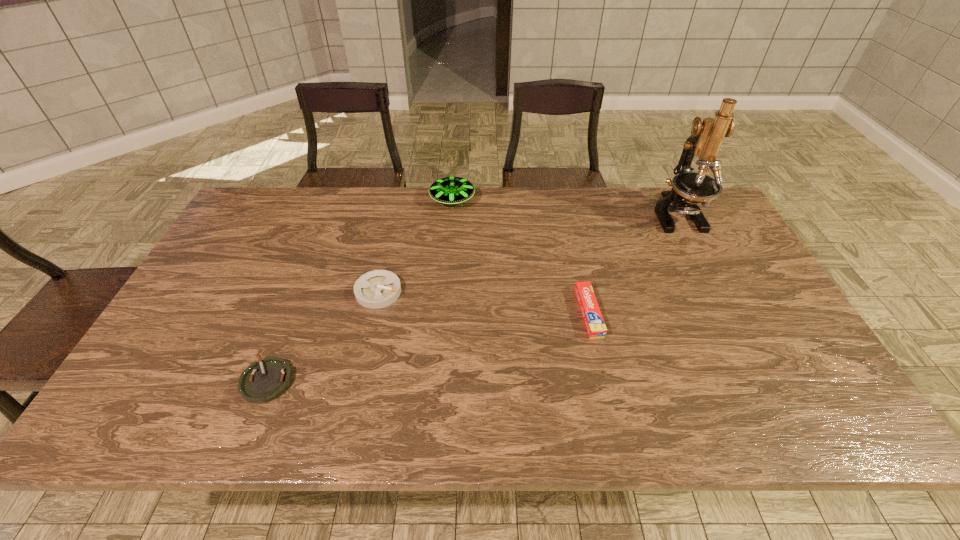
Find the location of `vacant space located 0.270m on the left of the third object from left to right`. vacant space located 0.270m on the left of the third object from left to right is located at coordinates (350, 200).

Identify the location of vacant space located on the back of the right ashtray. (390, 239).

At what (x,y) coordinates should I click in order to perform the action: click on vacant space located 0.240m on the right of the toothpaste. Please return your answer as a coordinate pair (x, y). This screenshot has height=540, width=960. Looking at the image, I should click on (690, 313).

The height and width of the screenshot is (540, 960). What are the coordinates of `vacant area located on the back of the left ashtray` in the screenshot? It's located at (293, 315).

Where is `microscope present at the far edge`? microscope present at the far edge is located at coordinates (689, 188).

Locate an element on the screen. The width and height of the screenshot is (960, 540). saucer that is at the far edge is located at coordinates (449, 190).

Locate an element on the screen. The height and width of the screenshot is (540, 960). object that is at the near edge is located at coordinates (263, 381).

Identify the location of object at the right edge. The height and width of the screenshot is (540, 960). (689, 188).

Image resolution: width=960 pixels, height=540 pixels. I want to click on object that is at the far right corner, so click(689, 188).

Where is `vacant region at the far edge`? The image size is (960, 540). vacant region at the far edge is located at coordinates (385, 226).